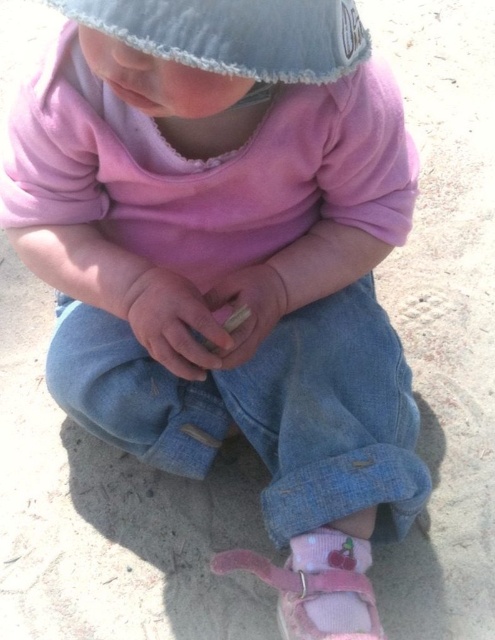
Question: Is denim knit hat at upper center above wooden stick at center?

Choices:
 (A) no
 (B) yes

Answer: (B)

Question: Can you confirm if denim knit hat at upper center is positioned to the left of wooden stick at center?

Choices:
 (A) yes
 (B) no

Answer: (B)

Question: Which object is the farthest from the smooth beige stick at center?

Choices:
 (A) wooden stick at center
 (B) denim knit hat at upper center

Answer: (B)

Question: Which point appears closest to the camera in this image?

Choices:
 (A) (143, 298)
 (B) (240, 1)
 (C) (280, 608)

Answer: (B)

Question: Among these objects, which one is nearest to the camera?

Choices:
 (A) pink suede shoe at lower center
 (B) smooth beige stick at center
 (C) wooden stick at center
 (D) denim knit hat at upper center

Answer: (D)

Question: Considering the relative positions of pink suede shoe at lower center and smooth beige stick at center in the image provided, where is pink suede shoe at lower center located with respect to smooth beige stick at center?

Choices:
 (A) below
 (B) above

Answer: (A)